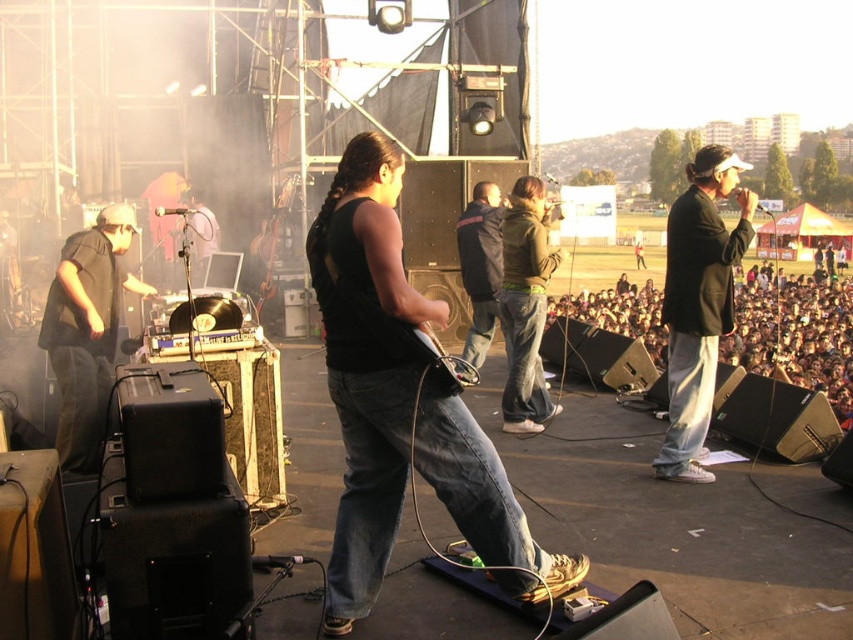
You are a photographer at the concert and want to capture both the black matte tank top at center and the black matte clothing at left in the same frame. What is the minimum distance you should keep between the camera and the subjects to ensure both are in focus?

The minimum distance should be at least 2.28 meters to ensure both the black matte tank top at center and the black matte clothing at left are in focus since they are 2.28 meters apart.

You are a photographer at the concert and want to capture both the black matte tank top at center and the black matte clothing at left in the same frame. Which one should you focus on first to ensure both are in focus?

The black matte tank top at center is positioned under the black matte clothing at left, so focusing on the black matte clothing at left first will ensure both are in focus.

From the picture: You are a photographer at the concert and want to capture a photo that includes both the dark brown cardboard crowd at right and the green fleece jacket at center. Based on their positions, which object should you focus on first to ensure both are in the frame?

The dark brown cardboard crowd at right is positioned on the right side of the green fleece jacket at center. To include both in the frame, focus on the green fleece jacket at center first, then adjust the camera to include the dark brown cardboard crowd at right on its right side.